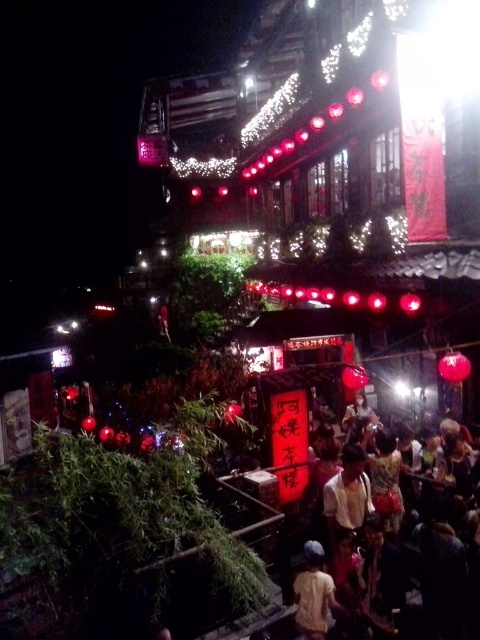
Who is lower down, matte black crowd at lower center or light yellow fabric at center?

light yellow fabric at center is below.

The width and height of the screenshot is (480, 640). I want to click on matte black crowd at lower center, so click(x=445, y=568).

Image resolution: width=480 pixels, height=640 pixels. I want to click on matte black crowd at lower center, so click(x=445, y=568).